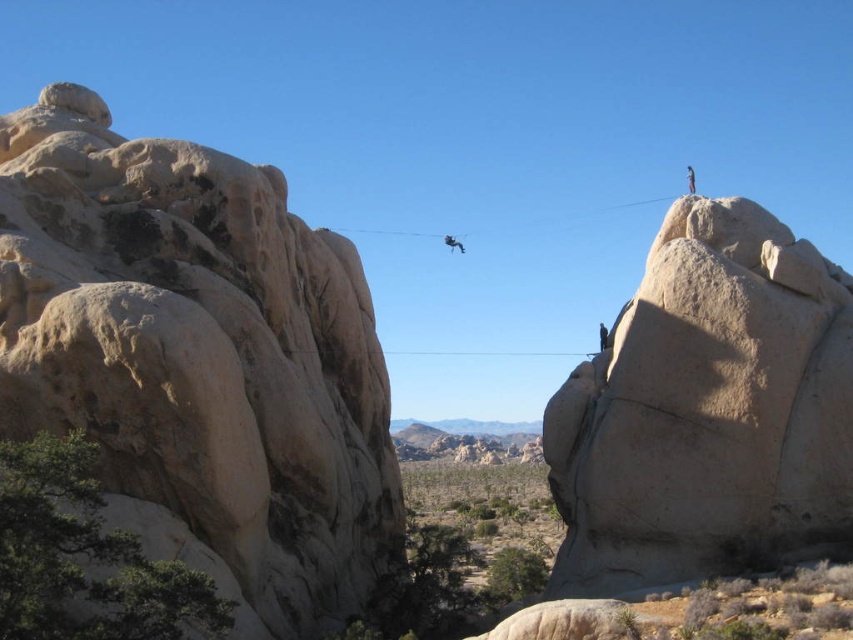
In the scene shown: You are planning to place a 3D model of the smooth beige rock at upper right next to the beige rough rock at left in a virtual environment. Given their sizes, which rock will appear bigger in the scene?

The beige rough rock at left is larger in width than the smooth beige rock at upper right, so it will appear bigger in the scene.

You are planning to set up a tent for camping in this desert scene. Given the beige rough rock at left and the smooth beige rock at upper right, which rock would provide a more stable base for the tent? Please explain your reasoning based on their sizes.

The beige rough rock at left is bigger than the smooth beige rock at upper right. Since a larger rock typically offers a more stable base due to its greater mass and surface area, the beige rough rock at left would provide a more stable base for the tent.